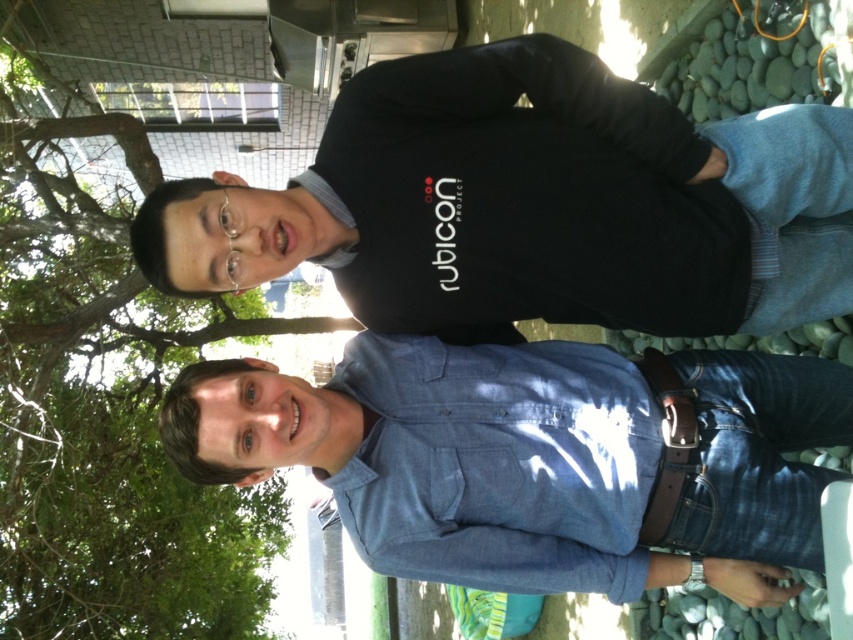
Question: Does blue denim shirt at center have a larger size compared to green leafy tree at upper left?

Choices:
 (A) no
 (B) yes

Answer: (A)

Question: Can you confirm if blue denim shirt at center is wider than green leafy tree at upper left?

Choices:
 (A) no
 (B) yes

Answer: (A)

Question: Among these objects, which one is farthest from the camera?

Choices:
 (A) green leafy tree at upper left
 (B) blue denim shirt at center

Answer: (A)

Question: Considering the relative positions of blue denim shirt at center and green leafy tree at upper left in the image provided, where is blue denim shirt at center located with respect to green leafy tree at upper left?

Choices:
 (A) below
 (B) above

Answer: (B)

Question: Which of the following is the farthest from the observer?

Choices:
 (A) (415, 573)
 (B) (122, 324)

Answer: (B)